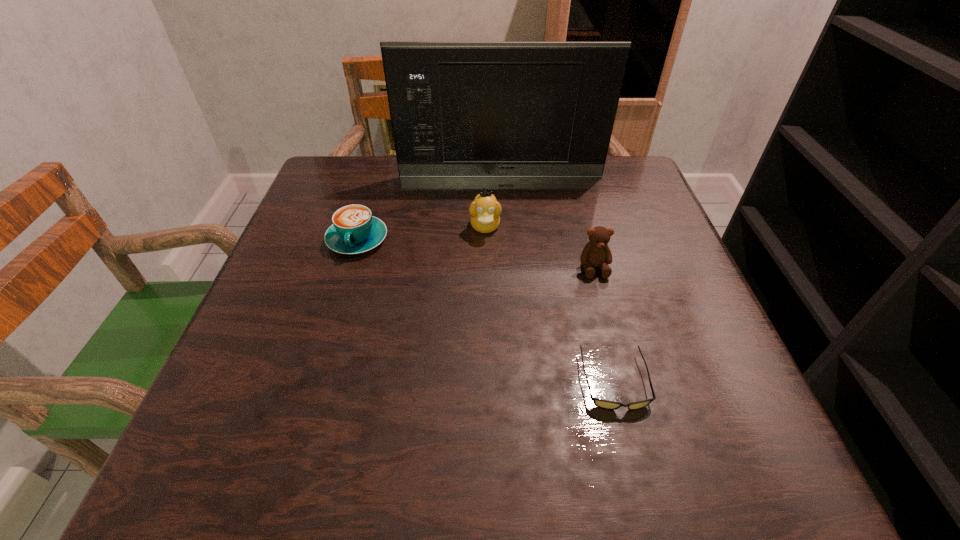
Locate an element on the screen. Image resolution: width=960 pixels, height=540 pixels. vacant space located with the handle on the right side of the fourth tallest object is located at coordinates (295, 448).

Where is `free region located 0.050m on the front-facing side of the shortest object`? This screenshot has height=540, width=960. free region located 0.050m on the front-facing side of the shortest object is located at coordinates (631, 446).

Locate an element on the screen. Image resolution: width=960 pixels, height=540 pixels. object at the far edge is located at coordinates (458, 109).

Locate an element on the screen. object that is at the left edge is located at coordinates (354, 230).

Where is `microwave oven that is at the right edge`? This screenshot has width=960, height=540. microwave oven that is at the right edge is located at coordinates (458, 109).

Locate an element on the screen. teddy bear positioned at the right edge is located at coordinates (596, 252).

Where is `sunglasses that is positioned at the right edge`? sunglasses that is positioned at the right edge is located at coordinates (605, 404).

In order to click on object located at the far right corner in this screenshot , I will do `click(458, 109)`.

Locate an element on the screen. free spot at the far edge of the desktop is located at coordinates (576, 186).

In the image, there is a desktop. Where is `free space at the near edge`? free space at the near edge is located at coordinates (405, 467).